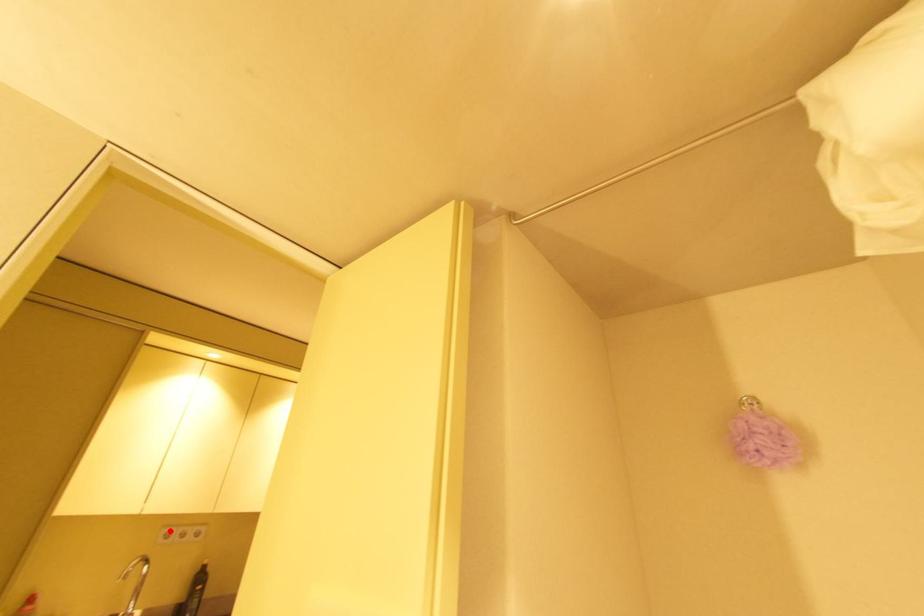
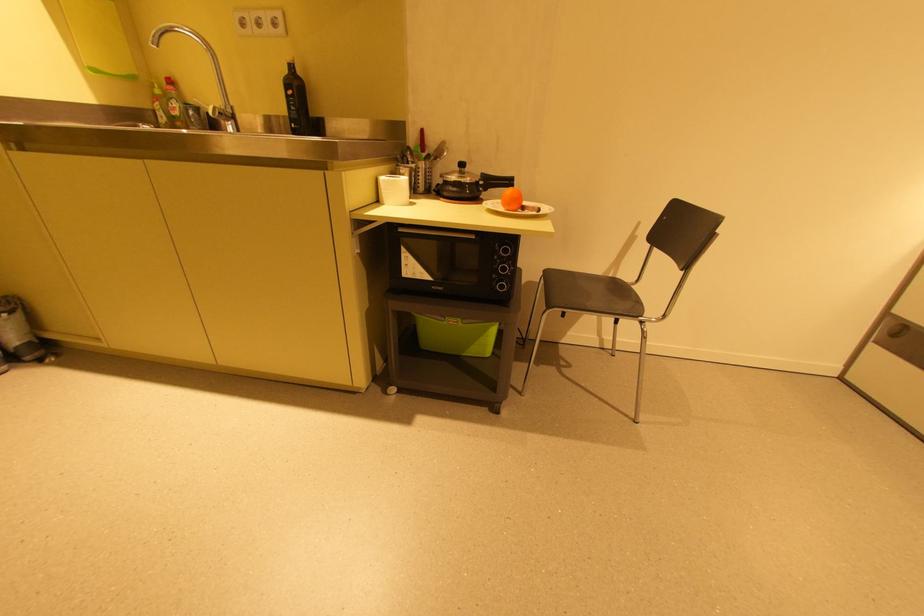
In the second image, find the point that corresponds to the highlighted location in the first image.

(242, 17)